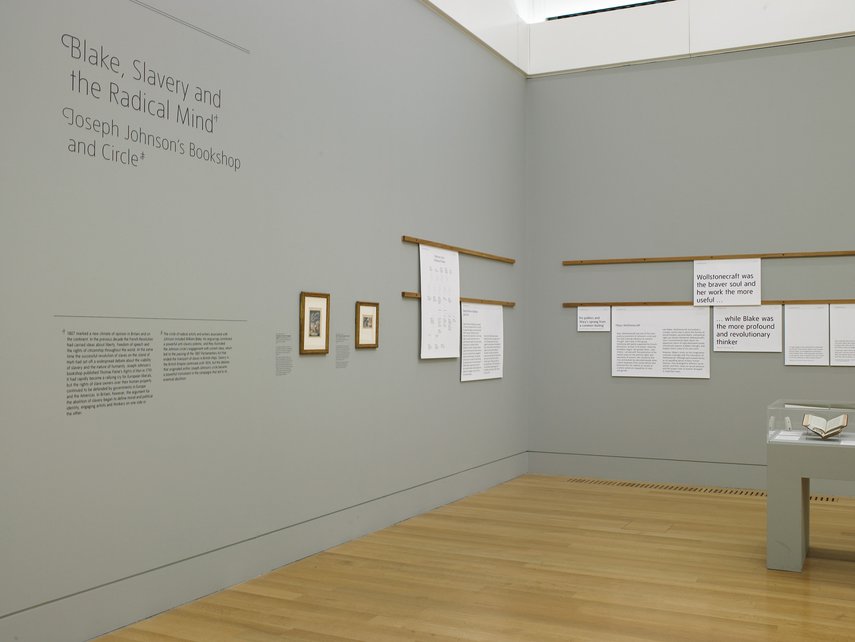
Locate an element on the screen. 2 picture frames is located at coordinates (325, 325), (366, 338).